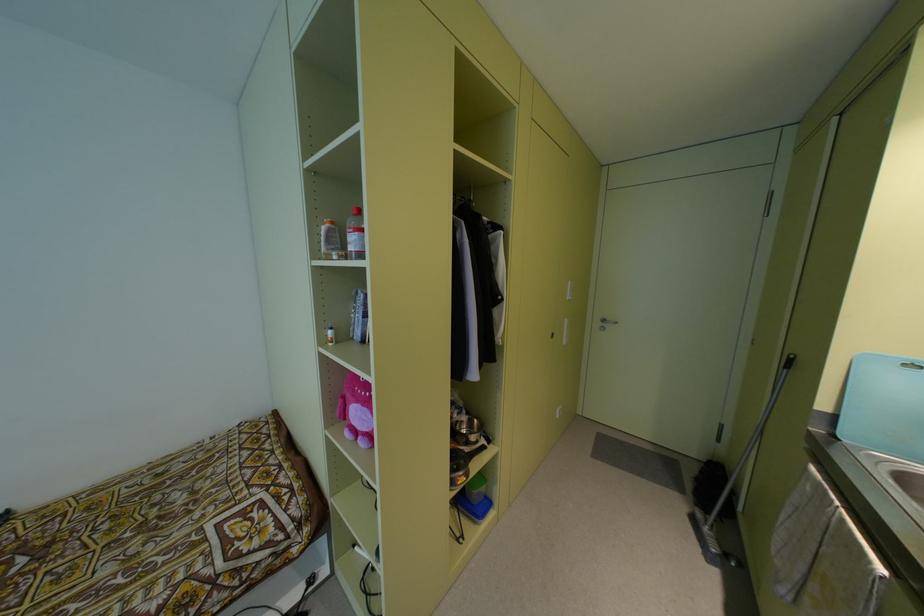
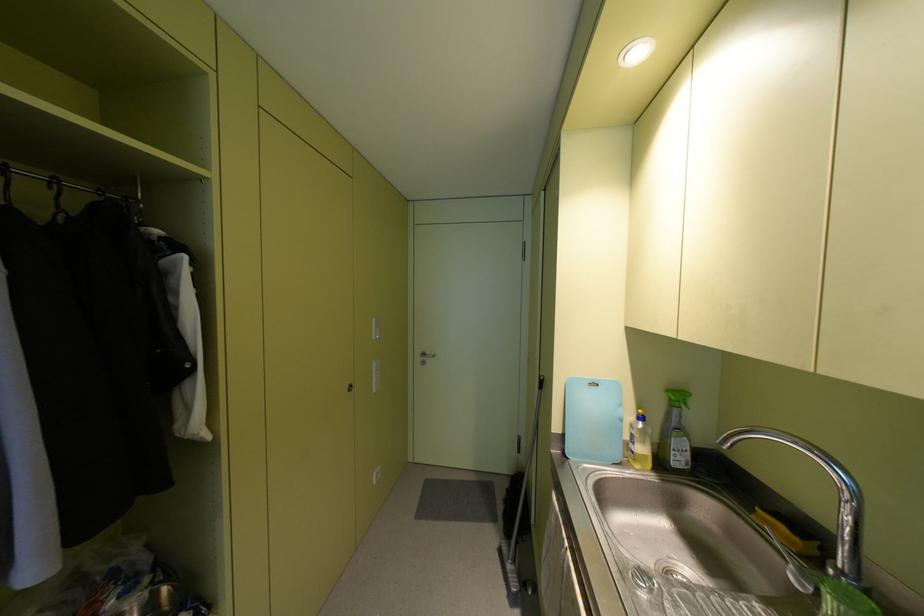
In the second image, find the point that corresponds to point 567,297 in the first image.

(373, 336)